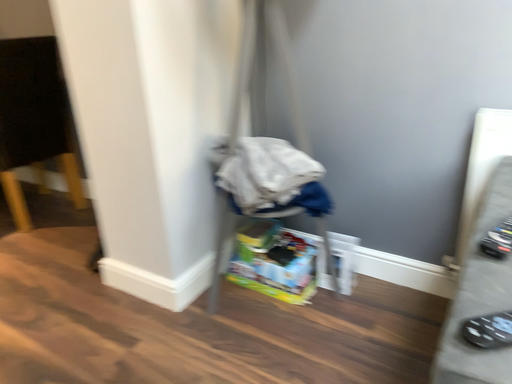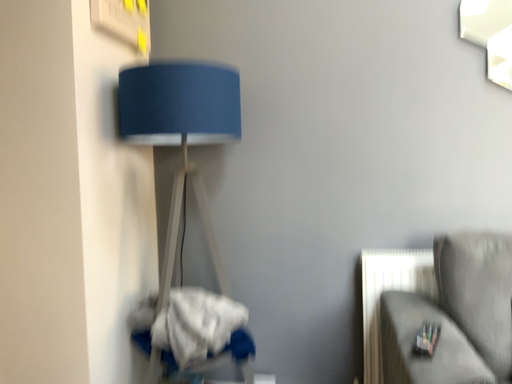
Question: How did the camera likely rotate when shooting the video?

Choices:
 (A) rotated downward
 (B) rotated upward

Answer: (B)